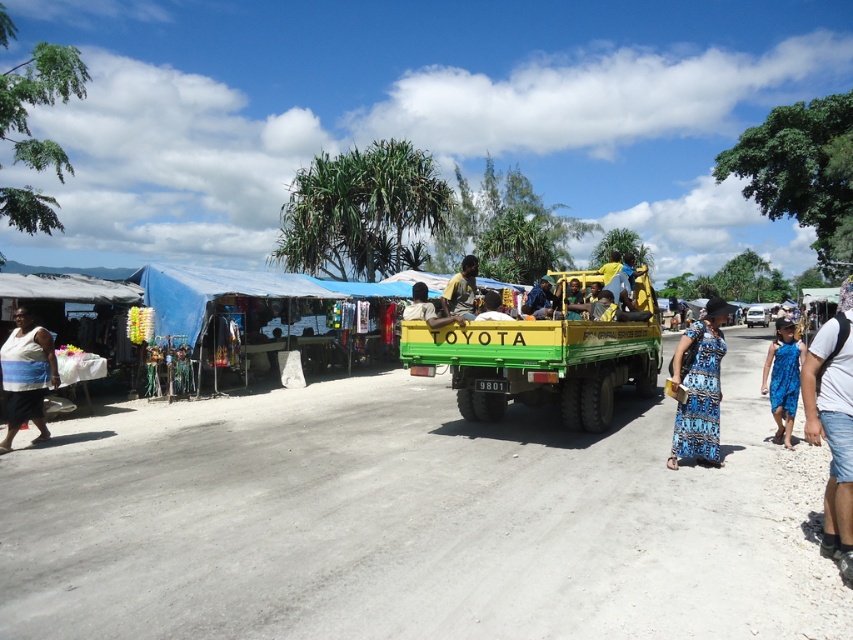
The image size is (853, 640). What do you see at coordinates (212, 292) in the screenshot?
I see `blue fabric canopy at left` at bounding box center [212, 292].

Does blue fabric canopy at left appear on the left side of yellow-green fabric at center?

Yes, blue fabric canopy at left is to the left of yellow-green fabric at center.

Does point (273, 298) come behind point (466, 278)?

Yes, it is behind point (466, 278).

I want to click on blue fabric canopy at left, so pos(212,292).

Describe the element at coordinates (543, 362) in the screenshot. I see `green matte truck at center` at that location.

Does green matte truck at center have a larger size compared to yellow fabric shirt at center?

Yes.

Between point (422, 364) and point (412, 291), which one is positioned in front?

Point (422, 364)

The height and width of the screenshot is (640, 853). What are the coordinates of `green matte truck at center` in the screenshot? It's located at (543, 362).

Which is more to the left, yellow-green fabric at center or yellow fabric shirt at center?

yellow fabric shirt at center is more to the left.

Find the location of a particular element. yellow-green fabric at center is located at coordinates (461, 289).